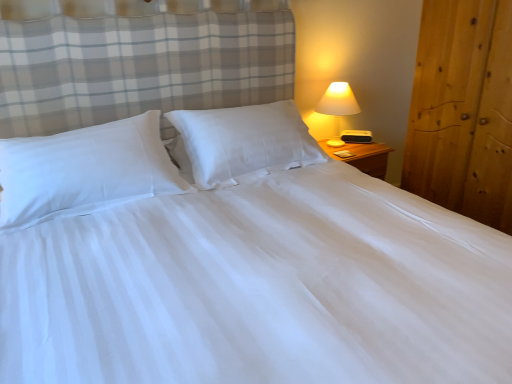
Question: From the image's perspective, is matte white lamp at right over white smooth pillow at center, which is the 2th pillow from left to right?

Choices:
 (A) no
 (B) yes

Answer: (B)

Question: Is matte white lamp at right thinner than white smooth pillow at center, positioned as the 1th pillow in right-to-left order?

Choices:
 (A) no
 (B) yes

Answer: (B)

Question: Is matte white lamp at right outside of white smooth pillow at center, which is the 2th pillow from left to right?

Choices:
 (A) no
 (B) yes

Answer: (B)

Question: Can you confirm if matte white lamp at right is positioned to the right of white smooth pillow at center, positioned as the 1th pillow in right-to-left order?

Choices:
 (A) no
 (B) yes

Answer: (B)

Question: Does matte white lamp at right lie in front of white smooth pillow at center, positioned as the 1th pillow in right-to-left order?

Choices:
 (A) yes
 (B) no

Answer: (B)

Question: Is wooden wardrobe at right taller or shorter than white smooth pillow at left, which appears as the first pillow when viewed from the left?

Choices:
 (A) short
 (B) tall

Answer: (B)

Question: Is wooden wardrobe at right spatially inside white smooth pillow at left, acting as the second pillow starting from the right, or outside of it?

Choices:
 (A) outside
 (B) inside

Answer: (A)

Question: In the image, is wooden wardrobe at right positioned in front of or behind white smooth pillow at left, which appears as the first pillow when viewed from the left?

Choices:
 (A) front
 (B) behind

Answer: (B)

Question: Is point (460, 185) closer or farther from the camera than point (40, 193)?

Choices:
 (A) closer
 (B) farther

Answer: (B)

Question: Would you say white smooth pillow at center, which is the 2th pillow from left to right, is to the left or to the right of matte white lamp at right in the picture?

Choices:
 (A) left
 (B) right

Answer: (A)

Question: From a real-world perspective, is white smooth pillow at center, which is the 2th pillow from left to right, above or below matte white lamp at right?

Choices:
 (A) below
 (B) above

Answer: (B)

Question: From the image's perspective, is white smooth pillow at center, positioned as the 1th pillow in right-to-left order, positioned above or below matte white lamp at right?

Choices:
 (A) above
 (B) below

Answer: (B)

Question: Is white smooth pillow at center, positioned as the 1th pillow in right-to-left order, inside or outside of matte white lamp at right?

Choices:
 (A) inside
 (B) outside

Answer: (B)

Question: Is wooden wardrobe at right wider or thinner than white smooth pillow at center, which is the 2th pillow from left to right?

Choices:
 (A) wide
 (B) thin

Answer: (A)

Question: Would you say wooden wardrobe at right is to the left or to the right of white smooth pillow at center, which is the 2th pillow from left to right, in the picture?

Choices:
 (A) right
 (B) left

Answer: (A)